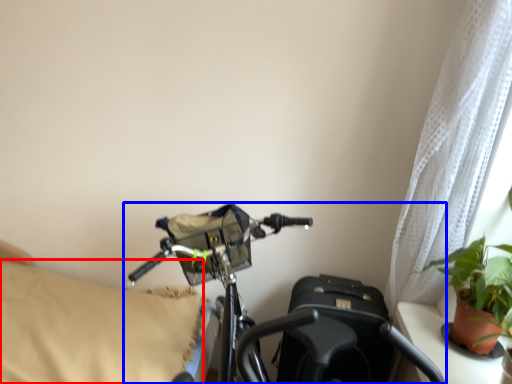
Question: Among these objects, which one is farthest to the camera, pillow (highlighted by a red box) or bicycle (highlighted by a blue box)?

Choices:
 (A) pillow
 (B) bicycle

Answer: (A)